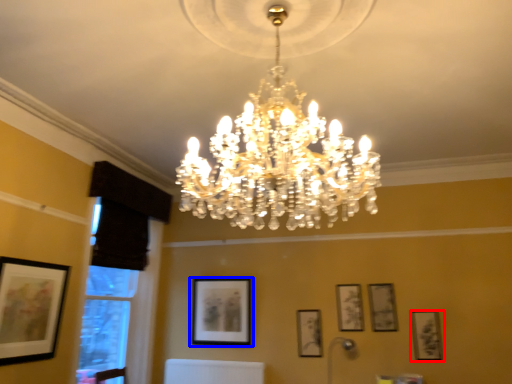
Question: Which object appears closest to the camera in this image, picture frame (highlighted by a red box) or picture frame (highlighted by a blue box)?

Choices:
 (A) picture frame
 (B) picture frame

Answer: (A)